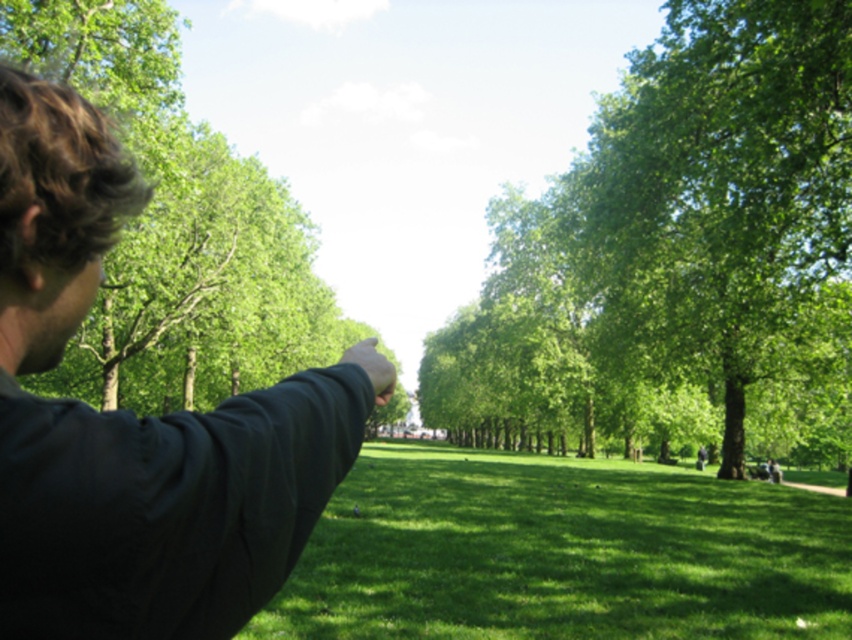
Question: Is green leafy tree at center to the left of dark green fabric arm at left from the viewer's perspective?

Choices:
 (A) no
 (B) yes

Answer: (A)

Question: Is dark green fabric arm at left bigger than green grassy field at center?

Choices:
 (A) no
 (B) yes

Answer: (A)

Question: Which object appears closest to the camera in this image?

Choices:
 (A) green leafy tree at center
 (B) dark green fabric arm at left

Answer: (B)

Question: Based on their relative distances, which object is nearer to the green grassy field at center?

Choices:
 (A) dark green fabric arm at left
 (B) green leafy tree at center

Answer: (A)

Question: Among these objects, which one is farthest from the camera?

Choices:
 (A) dark green fabric arm at left
 (B) green grassy field at center
 (C) green leafy tree at center

Answer: (C)

Question: Does green leafy tree at center appear over dark green fabric arm at left?

Choices:
 (A) no
 (B) yes

Answer: (B)